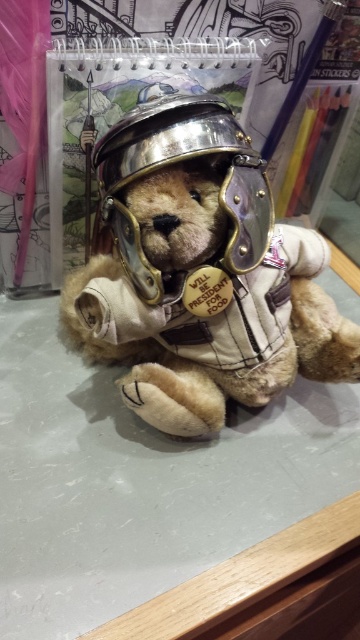
How much distance is there between velvet brown teddy bear at center and metallic silver helmet at center?

velvet brown teddy bear at center is 2.55 inches away from metallic silver helmet at center.

Consider the image. Does velvet brown teddy bear at center have a lesser height compared to metallic silver helmet at center?

In fact, velvet brown teddy bear at center may be taller than metallic silver helmet at center.

Measure the distance between point (172, 365) and camera.

Point (172, 365) is 1.24 meters from camera.

The image size is (360, 640). In order to click on velvet brown teddy bear at center in this screenshot , I will do `click(200, 275)`.